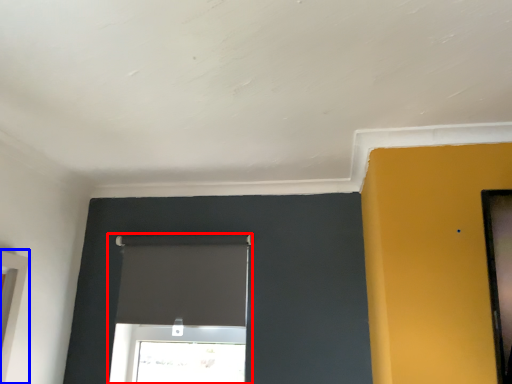
Question: Which object appears farthest to the camera in this image, window (highlighted by a red box) or window (highlighted by a blue box)?

Choices:
 (A) window
 (B) window

Answer: (A)